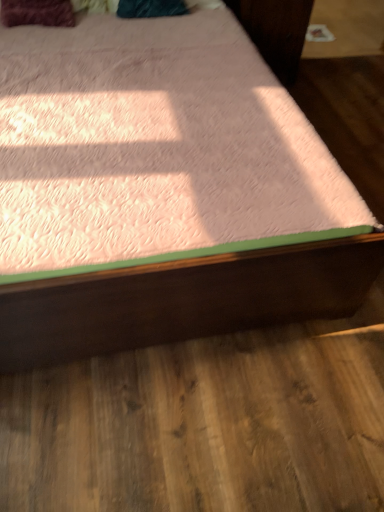
Question: Considering the relative sizes of velvet maroon pillow at upper left and pink plush bed at center in the image provided, is velvet maroon pillow at upper left taller than pink plush bed at center?

Choices:
 (A) no
 (B) yes

Answer: (A)

Question: Is pink plush bed at center located within velvet maroon pillow at upper left?

Choices:
 (A) no
 (B) yes

Answer: (A)

Question: Considering the relative sizes of velvet maroon pillow at upper left and pink plush bed at center in the image provided, is velvet maroon pillow at upper left thinner than pink plush bed at center?

Choices:
 (A) no
 (B) yes

Answer: (B)

Question: From the image's perspective, is velvet maroon pillow at upper left on top of pink plush bed at center?

Choices:
 (A) yes
 (B) no

Answer: (A)

Question: Can you confirm if velvet maroon pillow at upper left is smaller than pink plush bed at center?

Choices:
 (A) no
 (B) yes

Answer: (B)

Question: From a real-world perspective, is velvet maroon pillow at upper left over pink plush bed at center?

Choices:
 (A) no
 (B) yes

Answer: (B)

Question: Does pink plush bed at center have a larger size compared to velvet maroon pillow at upper left?

Choices:
 (A) yes
 (B) no

Answer: (A)

Question: Does pink plush bed at center contain velvet maroon pillow at upper left?

Choices:
 (A) yes
 (B) no

Answer: (A)

Question: Does pink plush bed at center appear on the right side of velvet maroon pillow at upper left?

Choices:
 (A) yes
 (B) no

Answer: (A)

Question: Is pink plush bed at center wider than velvet maroon pillow at upper left?

Choices:
 (A) no
 (B) yes

Answer: (B)

Question: Is pink plush bed at center completely or partially outside of velvet maroon pillow at upper left?

Choices:
 (A) yes
 (B) no

Answer: (A)

Question: Is there a large distance between pink plush bed at center and velvet maroon pillow at upper left?

Choices:
 (A) no
 (B) yes

Answer: (A)

Question: From a real-world perspective, is pink plush bed at center physically located above or below velvet maroon pillow at upper left?

Choices:
 (A) above
 (B) below

Answer: (B)